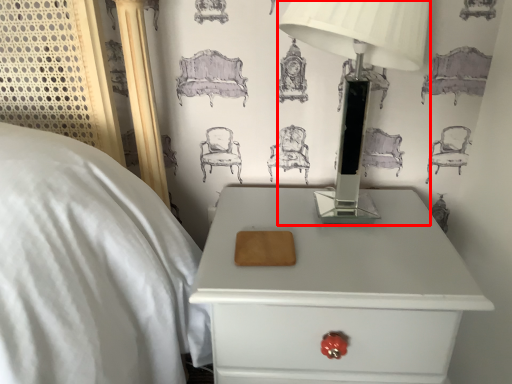
Question: Where is table lamp (annotated by the red box) located in relation to nightstand in the image?

Choices:
 (A) left
 (B) right

Answer: (B)